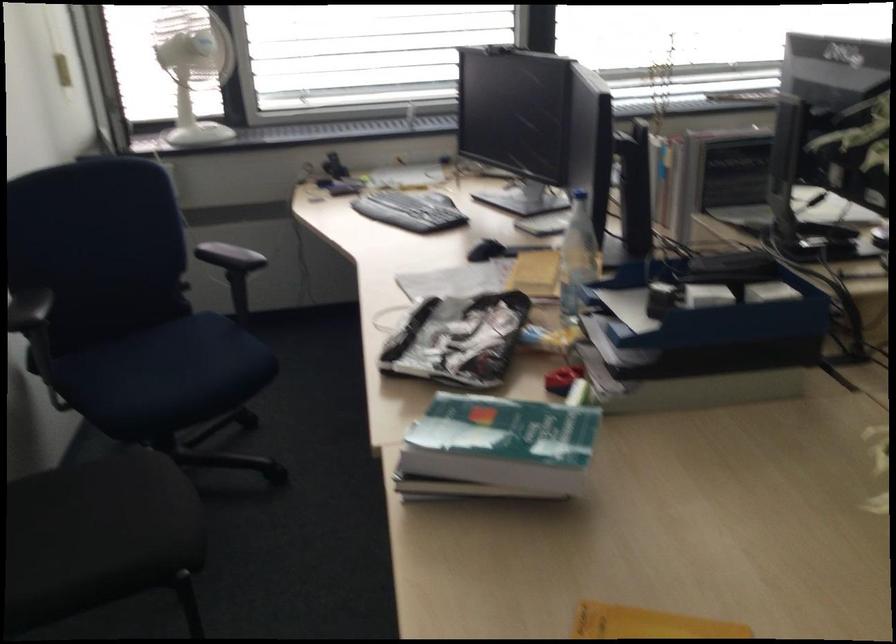
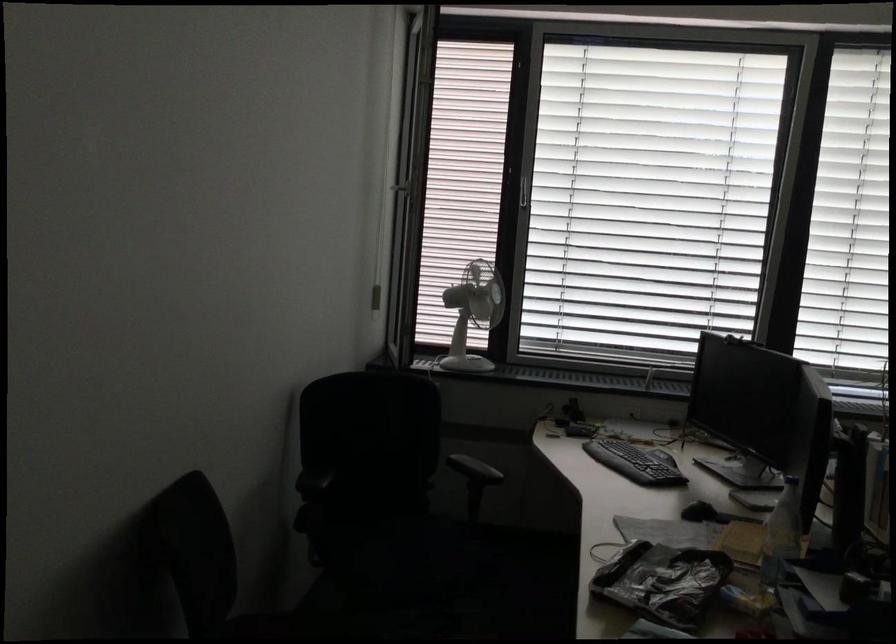
Question: What movement of the cameraman would produce the second image?

Choices:
 (A) Left
 (B) Right
 (C) Forward
 (D) Backward

Answer: (D)